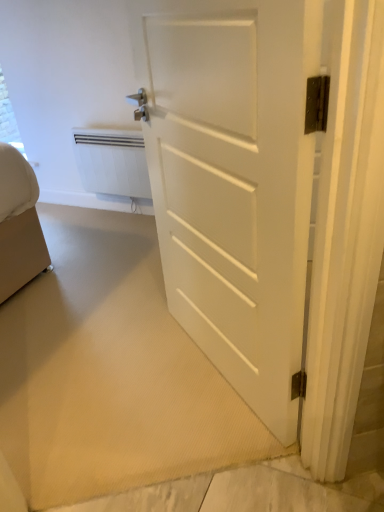
This screenshot has width=384, height=512. What do you see at coordinates (112, 162) in the screenshot? I see `white matte radiator at upper left` at bounding box center [112, 162].

Where is `white matte radiator at upper left`? This screenshot has height=512, width=384. white matte radiator at upper left is located at coordinates (112, 162).

Measure the distance between point (121, 154) and camera.

They are 8.53 feet apart.

This screenshot has height=512, width=384. I want to click on white matte door at center, so click(x=236, y=185).

The width and height of the screenshot is (384, 512). Describe the element at coordinates (236, 185) in the screenshot. I see `white matte door at center` at that location.

What is the approximate height of white matte door at center?

It is 1.27 meters.

What are the coordinates of `white matte radiator at upper left` in the screenshot? It's located at (112, 162).

Considering the relative positions of white matte radiator at upper left and white matte door at center in the image provided, is white matte radiator at upper left to the left of white matte door at center from the viewer's perspective?

Yes.

In the image, is white matte radiator at upper left positioned in front of or behind white matte door at center?

Visually, white matte radiator at upper left is located behind white matte door at center.

Is point (113, 192) closer to camera compared to point (269, 80)?

No, (113, 192) is behind (269, 80).

From the image's perspective, which one is positioned lower, white matte radiator at upper left or white matte door at center?

white matte door at center, from the image's perspective.

From a real-world perspective, is white matte radiator at upper left below white matte door at center?

Yes, from a real-world perspective, white matte radiator at upper left is under white matte door at center.

Is white matte radiator at upper left wider than white matte door at center?

Incorrect, the width of white matte radiator at upper left does not surpass that of white matte door at center.

In the scene shown: Who is taller, white matte radiator at upper left or white matte door at center?

Standing taller between the two is white matte door at center.

Is white matte radiator at upper left bigger than white matte door at center?

No, white matte radiator at upper left is not bigger than white matte door at center.

Can white matte door at center be found inside white matte radiator at upper left?

No, white matte radiator at upper left does not contain white matte door at center.

Is white matte radiator at upper left placed right next to white matte door at center?

white matte radiator at upper left and white matte door at center are clearly separated.

Could you tell me if white matte radiator at upper left is turned towards white matte door at center?

No, white matte radiator at upper left does not turn towards white matte door at center.

What's the angular difference between white matte radiator at upper left and white matte door at center's facing directions?

white matte radiator at upper left and white matte door at center are facing 35.8 degrees away from each other.

The width and height of the screenshot is (384, 512). I want to click on radiator lying on the left of white matte door at center, so click(112, 162).

Would you say white matte door at center is to the left or to the right of white matte radiator at upper left in the picture?

Based on their positions, white matte door at center is located to the right of white matte radiator at upper left.

Which is in front, white matte door at center or white matte radiator at upper left?

Positioned in front is white matte door at center.

Considering the positions of points (195, 281) and (81, 140), is point (195, 281) closer to camera compared to point (81, 140)?

That is True.

Based on the photo, from the image's perspective, is white matte door at center on top of white matte radiator at upper left?

No, from the image's perspective, white matte door at center is not above white matte radiator at upper left.

From a real-world perspective, which is physically above, white matte door at center or white matte radiator at upper left?

In real-world perspective, white matte door at center is above.

Considering the relative sizes of white matte door at center and white matte radiator at upper left in the image provided, is white matte door at center thinner than white matte radiator at upper left?

No, white matte door at center is not thinner than white matte radiator at upper left.

Considering the sizes of objects white matte door at center and white matte radiator at upper left in the image provided, who is taller, white matte door at center or white matte radiator at upper left?

Standing taller between the two is white matte door at center.

Considering the sizes of objects white matte door at center and white matte radiator at upper left in the image provided, who is bigger, white matte door at center or white matte radiator at upper left?

white matte door at center.

Can white matte radiator at upper left be found inside white matte door at center?

That's incorrect, white matte radiator at upper left is not inside white matte door at center.

Would you say white matte door at center is a long distance from white matte radiator at upper left?

Yes, white matte door at center and white matte radiator at upper left are located far from each other.

Is white matte door at center looking in the opposite direction of white matte radiator at upper left?

No.

How different are the orientations of white matte door at center and white matte radiator at upper left in degrees?

35.8 degrees separate the facing orientations of white matte door at center and white matte radiator at upper left.

Where is `radiator behind the white matte door at center`? The image size is (384, 512). radiator behind the white matte door at center is located at coordinates [112, 162].

The image size is (384, 512). In the image, there is a white matte door at center. What are the coordinates of `radiator below it (from a real-world perspective)` in the screenshot? It's located at (112, 162).

There is a white matte radiator at upper left. Identify the location of door above it (from a real-world perspective). This screenshot has height=512, width=384. (236, 185).